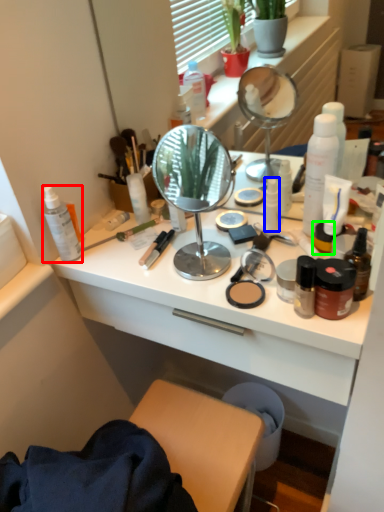
Question: Which object is positioned farthest from toiletry (highlighted by a red box)? Select from toiletry (highlighted by a blue box) and toiletry (highlighted by a green box).

Choices:
 (A) toiletry
 (B) toiletry

Answer: (B)